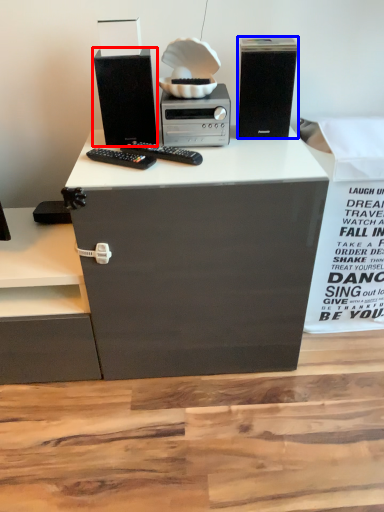
Question: Among these objects, which one is farthest to the camera, computer tower (highlighted by a red box) or computer tower (highlighted by a blue box)?

Choices:
 (A) computer tower
 (B) computer tower

Answer: (B)